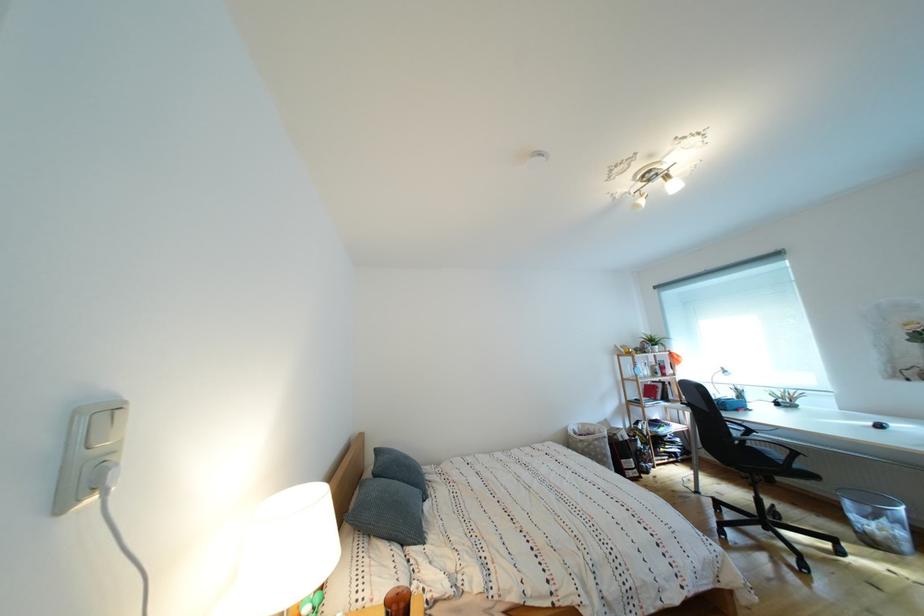
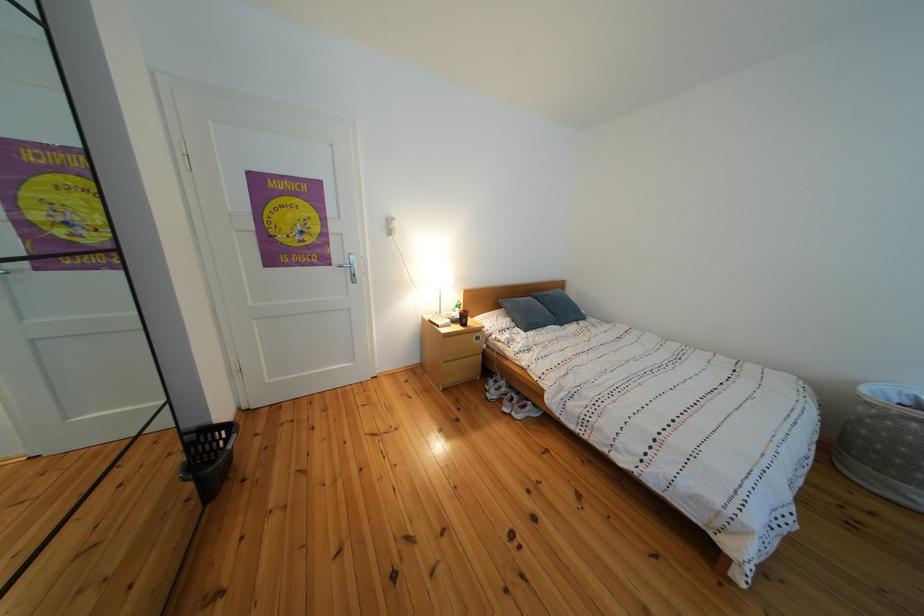
Where in the second image is the point corresponding to point (584, 439) from the first image?

(890, 398)